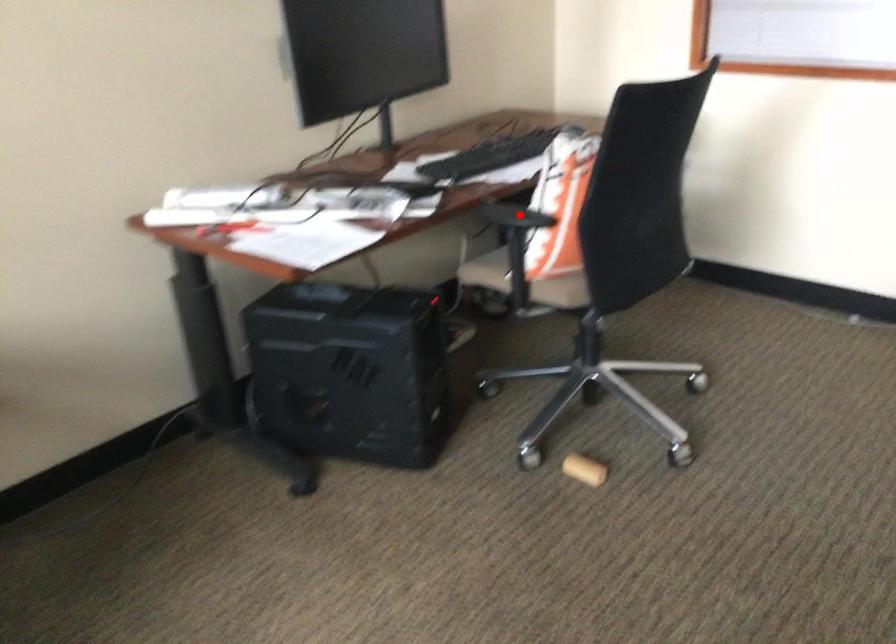
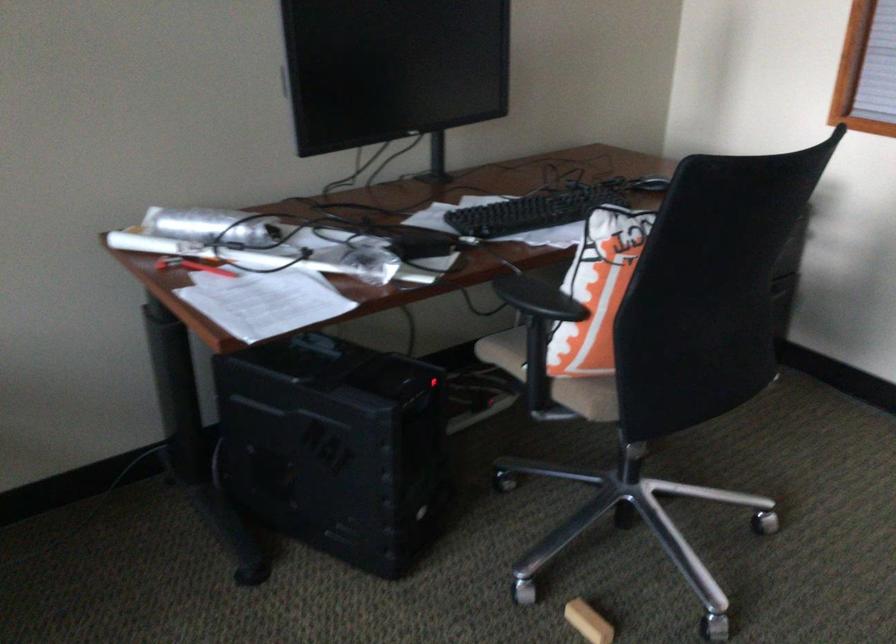
Where in the second image is the point corresponding to the highlighted location from the first image?

(538, 299)